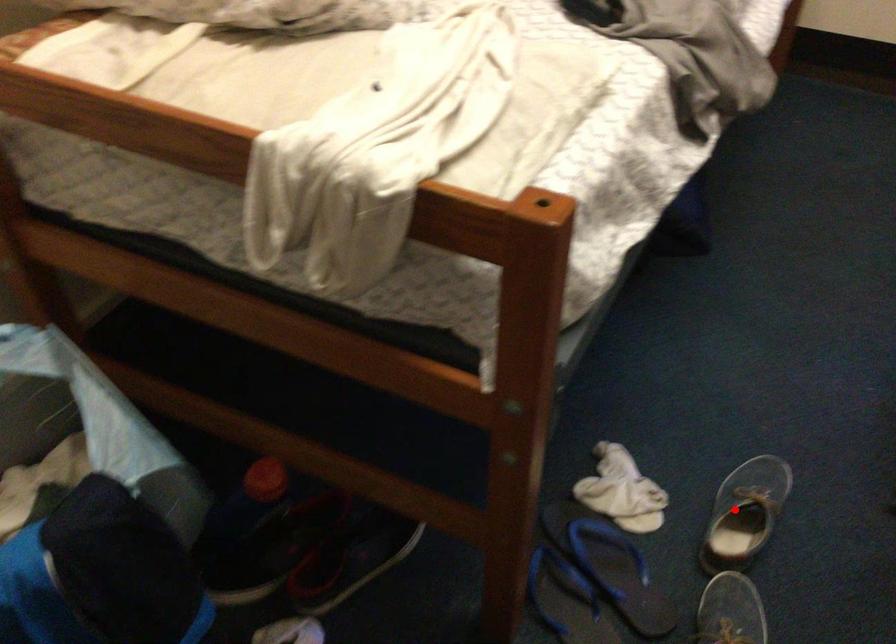
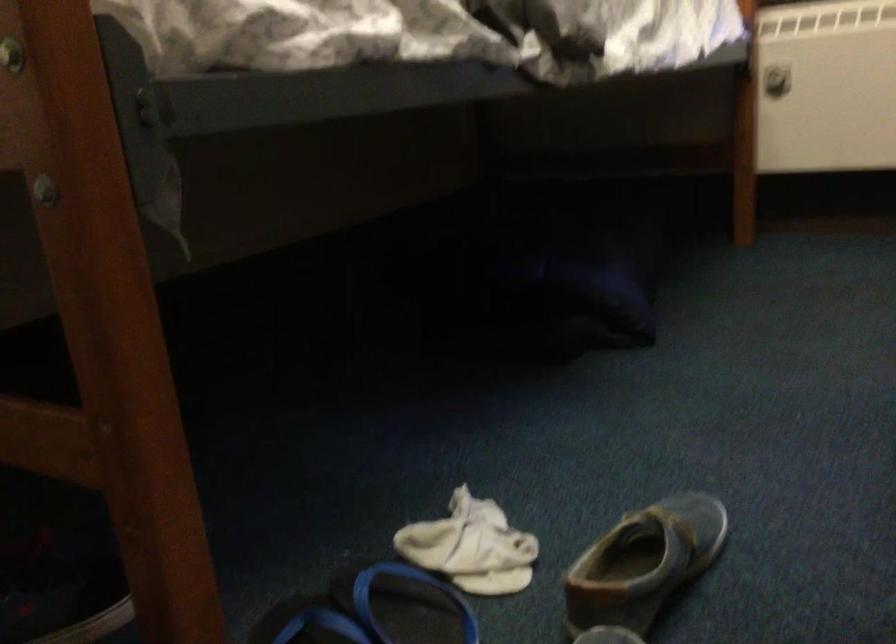
Question: I am providing you with two images of the same scene from different viewpoints. A red point is shown in image1. For the corresponding object point in image2, is it positioned nearer or farther from the camera?

Choices:
 (A) Nearer
 (B) Farther

Answer: (A)